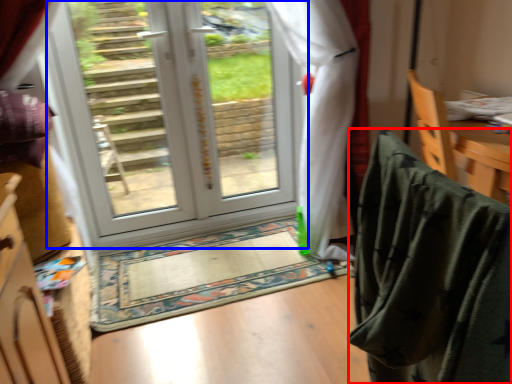
Question: Among these objects, which one is farthest to the camera, blanket (highlighted by a red box) or door (highlighted by a blue box)?

Choices:
 (A) blanket
 (B) door

Answer: (B)